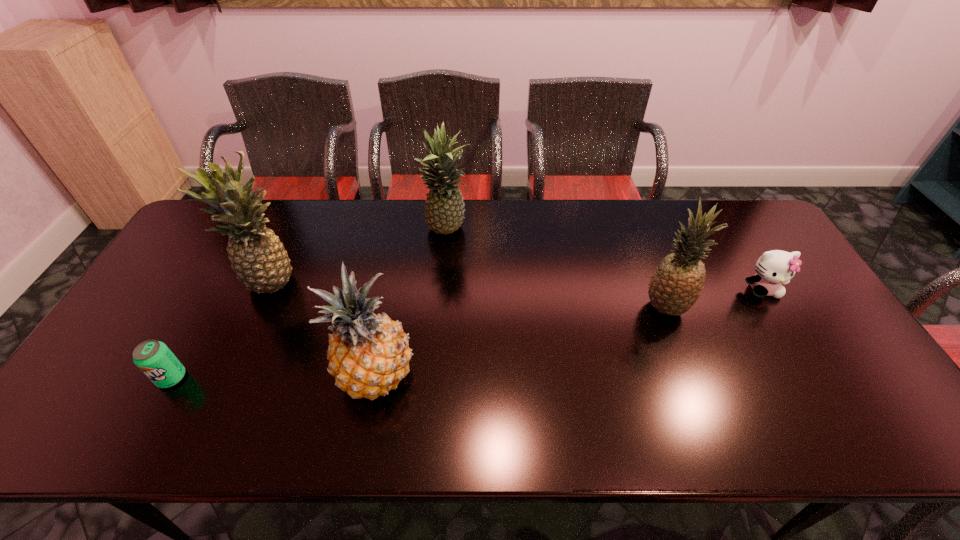
Where is `the fifth object from right to left`? the fifth object from right to left is located at coordinates (261, 263).

What are the coordinates of `the farthest object` in the screenshot? It's located at (444, 212).

The image size is (960, 540). Find the location of `the rightmost pineapple`. the rightmost pineapple is located at coordinates (676, 285).

At what (x,y) coordinates should I click in order to perform the action: click on the nearest pineapple. Please return your answer as a coordinate pair (x, y). Looking at the image, I should click on (369, 355).

Identify the location of the rightmost object. The image size is (960, 540). (775, 267).

I want to click on kitten, so click(x=775, y=267).

Locate an element on the screen. The width and height of the screenshot is (960, 540). the leftmost object is located at coordinates (152, 357).

Locate an element on the screen. Image resolution: width=960 pixels, height=540 pixels. pop soda is located at coordinates (152, 357).

Image resolution: width=960 pixels, height=540 pixels. Identify the location of free location located 0.200m on the left of the second object from left to right. (176, 284).

The width and height of the screenshot is (960, 540). In order to click on free space located on the right of the farthest pineapple in this screenshot , I will do `click(526, 231)`.